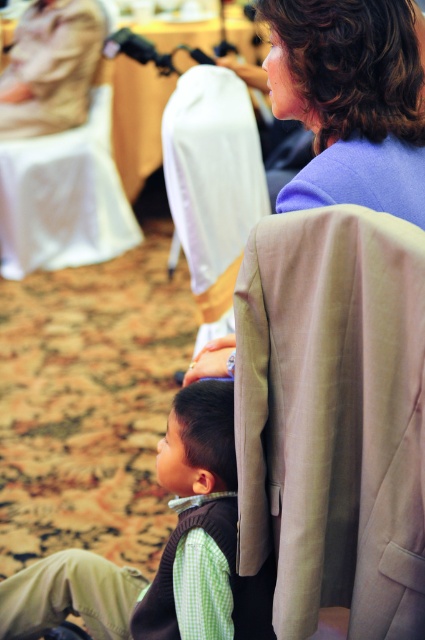
Can you confirm if white fabric chair at upper left is bigger than white fabric chair at center?

Indeed, white fabric chair at upper left has a larger size compared to white fabric chair at center.

Locate an element on the screen. Image resolution: width=425 pixels, height=640 pixels. white fabric chair at upper left is located at coordinates pos(64,196).

Does tan fabric chair at center have a smaller size compared to white fabric chair at center?

Correct, tan fabric chair at center occupies less space than white fabric chair at center.

Based on the photo, does tan fabric chair at center appear over white fabric chair at center?

Actually, tan fabric chair at center is below white fabric chair at center.

You are a GUI agent. You are given a task and a screenshot of the screen. Output one action in this format:
    pyautogui.click(x=<x>, y=<y>)
    Task: Click on the tan fabric chair at center
    
    Given the screenshot: What is the action you would take?
    pyautogui.click(x=333, y=417)

Locate an element on the screen. This screenshot has width=425, height=640. tan fabric chair at center is located at coordinates (333, 417).

Is tan fabric chair at center above green checkered shirt at lower left?

Yes, tan fabric chair at center is above green checkered shirt at lower left.

Which is behind, point (402, 326) or point (231, 467)?

The point (231, 467) is behind.

Does point (384, 460) lie in front of point (59, 600)?

That is True.

At what (x,y) coordinates should I click in order to perform the action: click on tan fabric chair at center. Please return your answer as a coordinate pair (x, y). The width and height of the screenshot is (425, 640). Looking at the image, I should click on (333, 417).